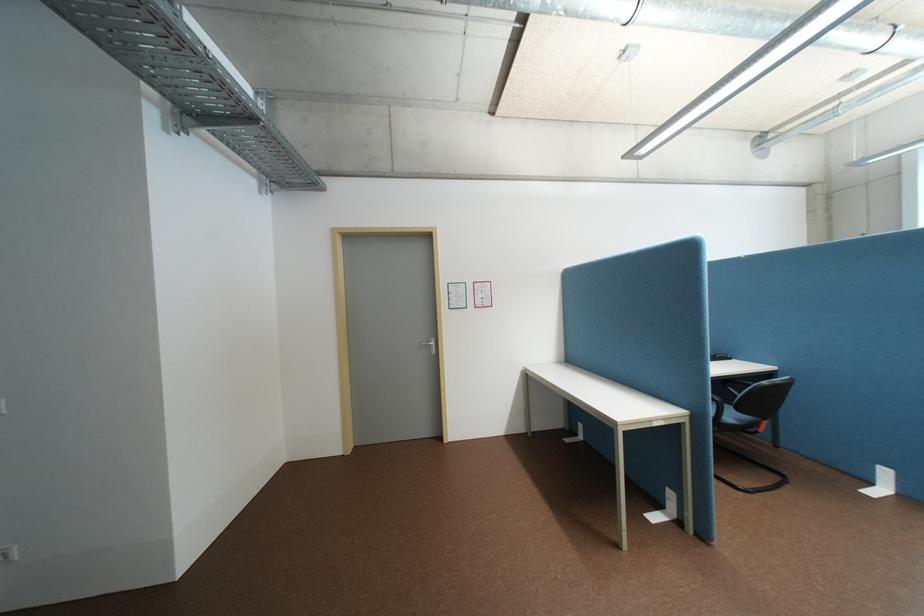
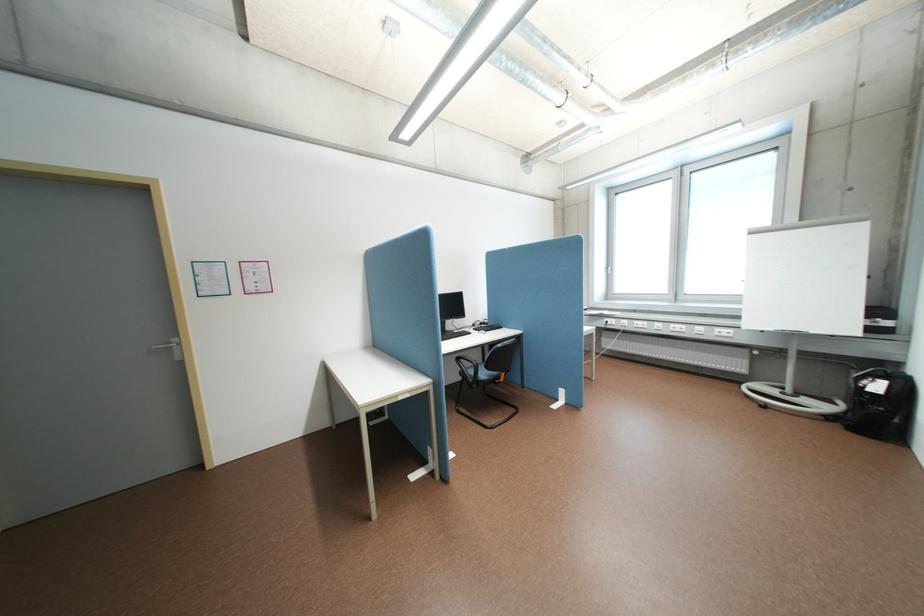
Question: How did the camera likely rotate?

Choices:
 (A) Left
 (B) Right
 (C) Up
 (D) Down

Answer: (B)